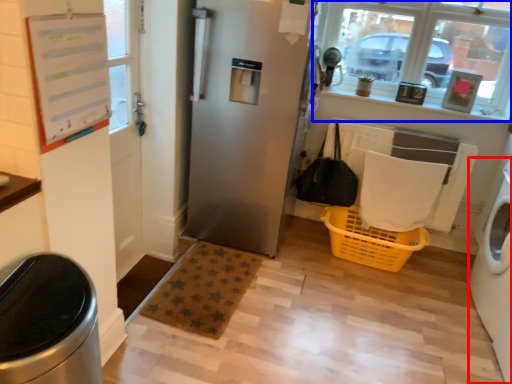
Question: Among these objects, which one is nearest to the camera, washing machine (highlighted by a red box) or window (highlighted by a blue box)?

Choices:
 (A) washing machine
 (B) window

Answer: (A)